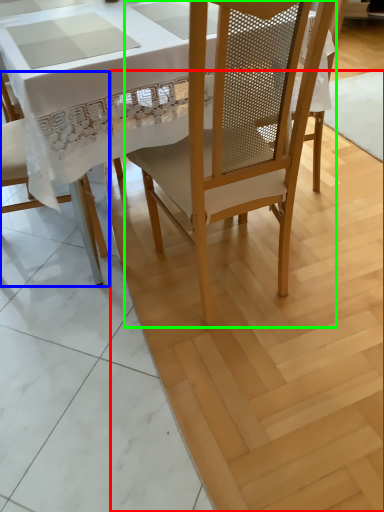
Question: Considering the real-world distances, which object is closest to plywood (highlighted by a red box)? chair (highlighted by a blue box) or chair (highlighted by a green box).

Choices:
 (A) chair
 (B) chair

Answer: (B)